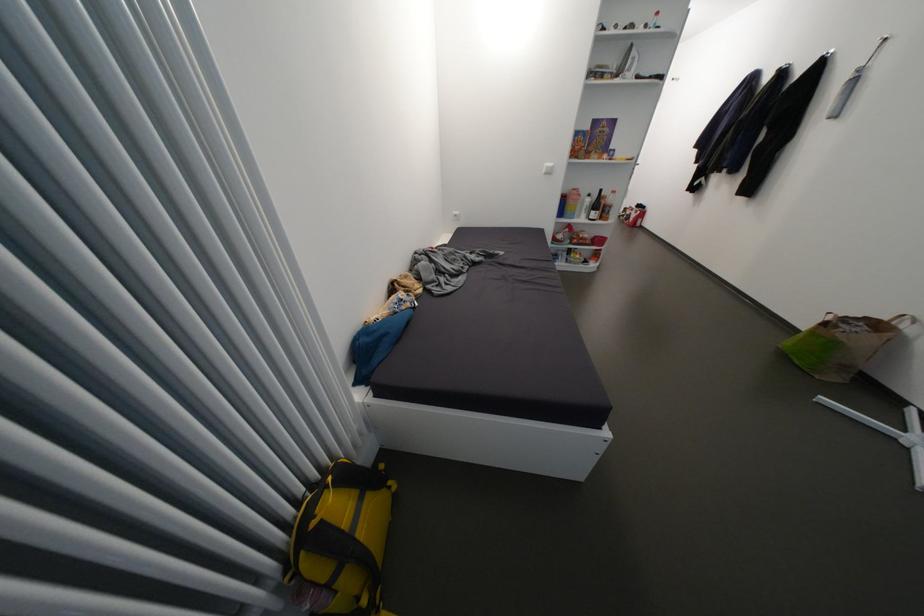
What are the coordinates of `white light switch` in the screenshot? It's located at (548, 168).